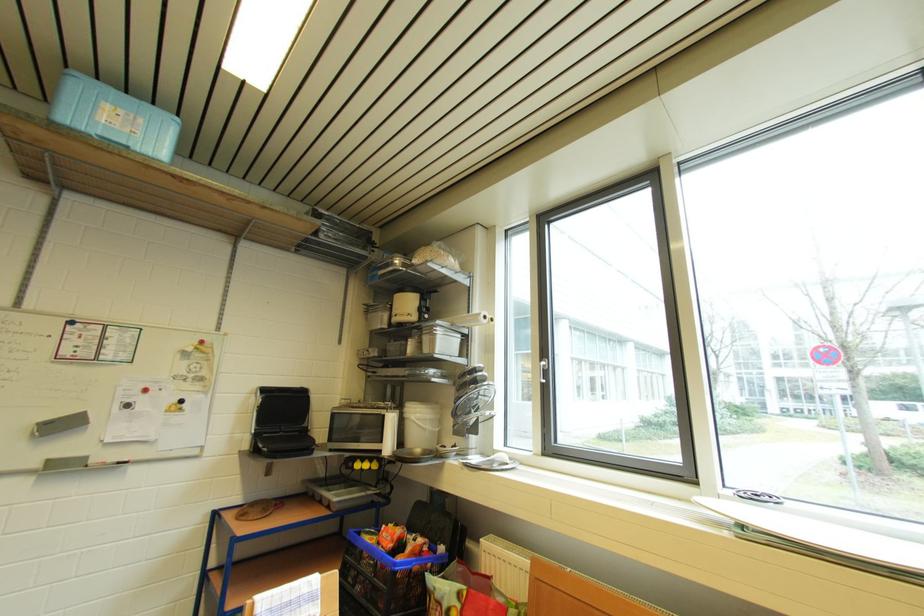
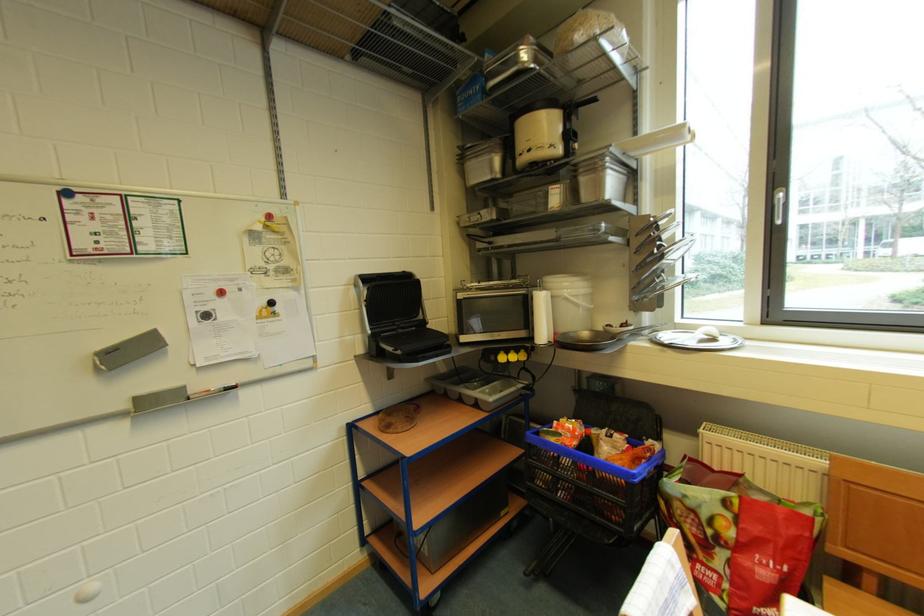
The images are taken continuously from a first-person perspective. In which direction are you moving?

The movement direction of the cameraman is left, forward.